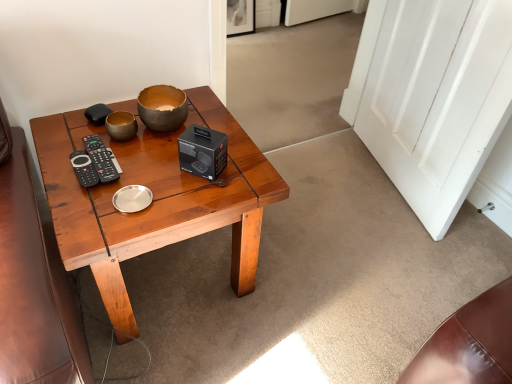
I want to click on vacant space to the left of white glossy door at right, so click(325, 187).